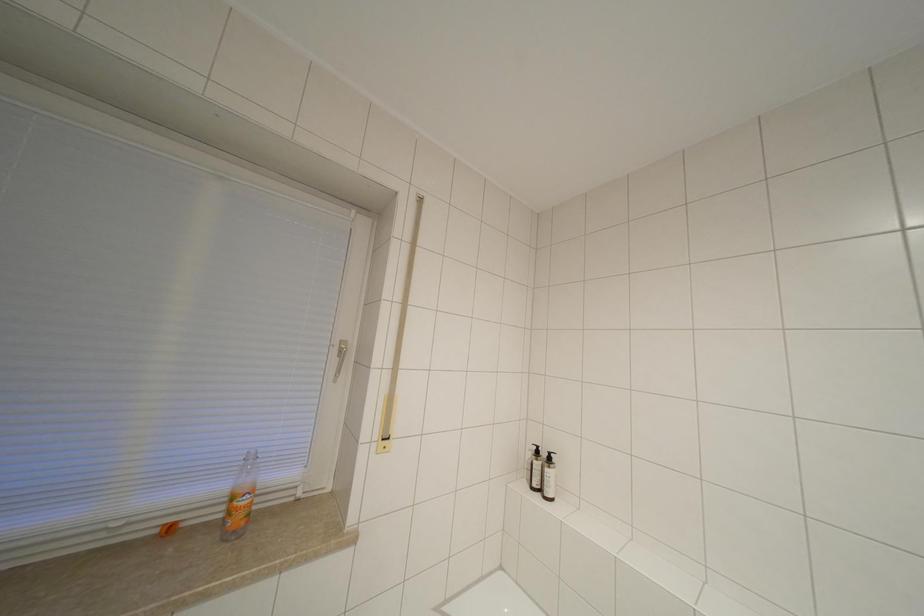
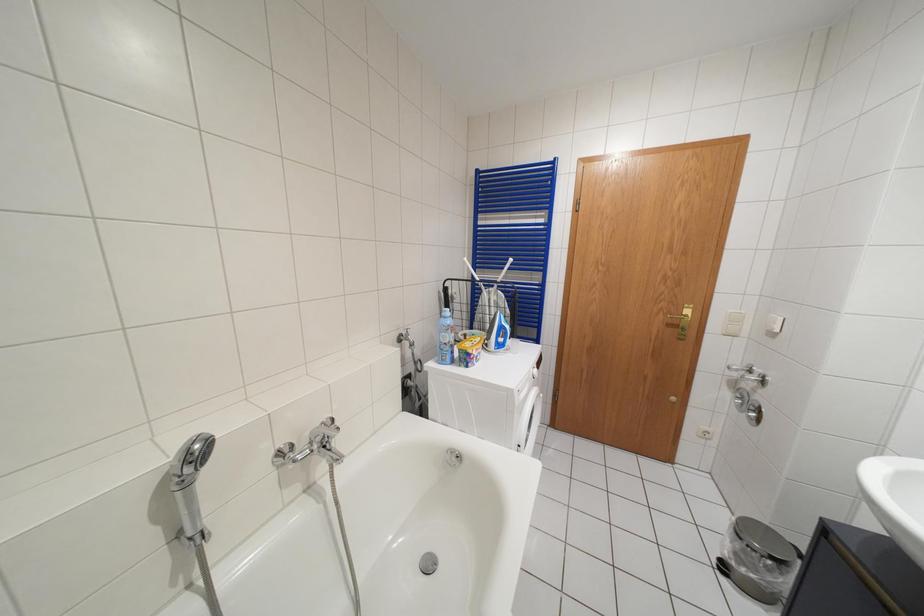
Question: How did the camera likely rotate?

Choices:
 (A) Left
 (B) Right
 (C) Up
 (D) Down

Answer: (B)